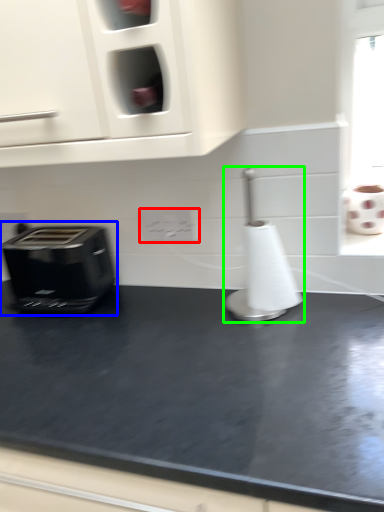
Question: Estimate the real-world distances between objects in this image. Which object is closer to electric outlet (highlighted by a red box), toaster (highlighted by a blue box) or appliance (highlighted by a green box)?

Choices:
 (A) toaster
 (B) appliance

Answer: (B)